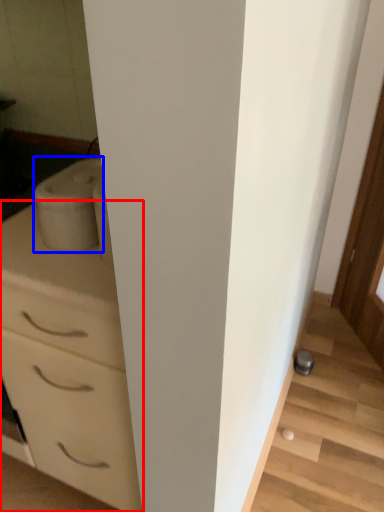
Question: Which point is closer to the camera, chest of drawers (highlighted by a red box) or appliance (highlighted by a blue box)?

Choices:
 (A) chest of drawers
 (B) appliance

Answer: (A)